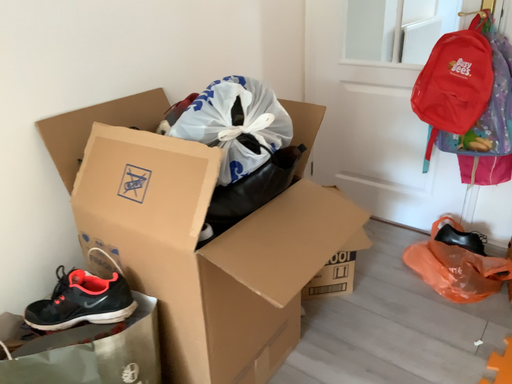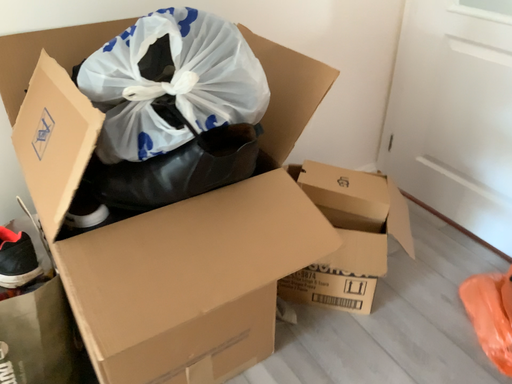
Question: How did the camera likely rotate when shooting the video?

Choices:
 (A) rotated left
 (B) rotated right

Answer: (A)